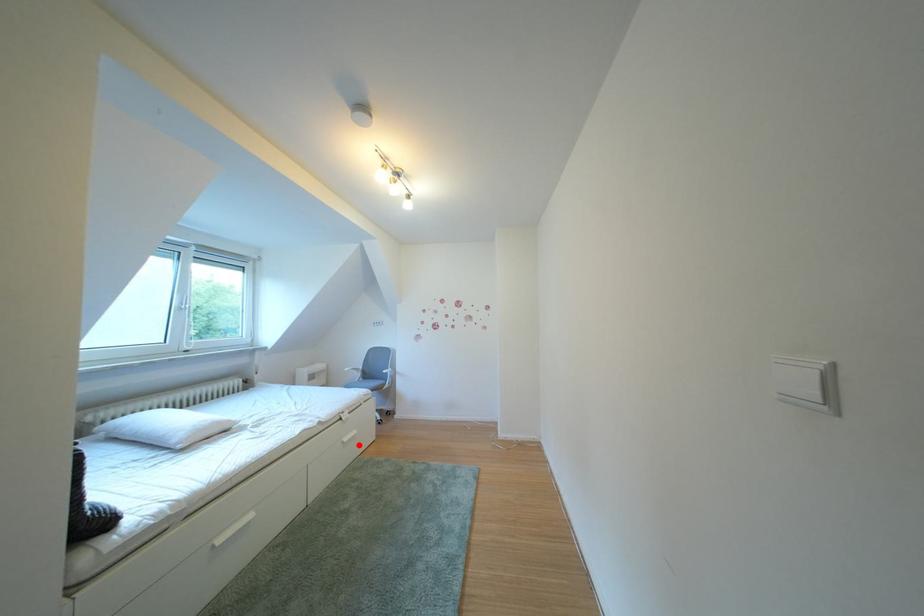
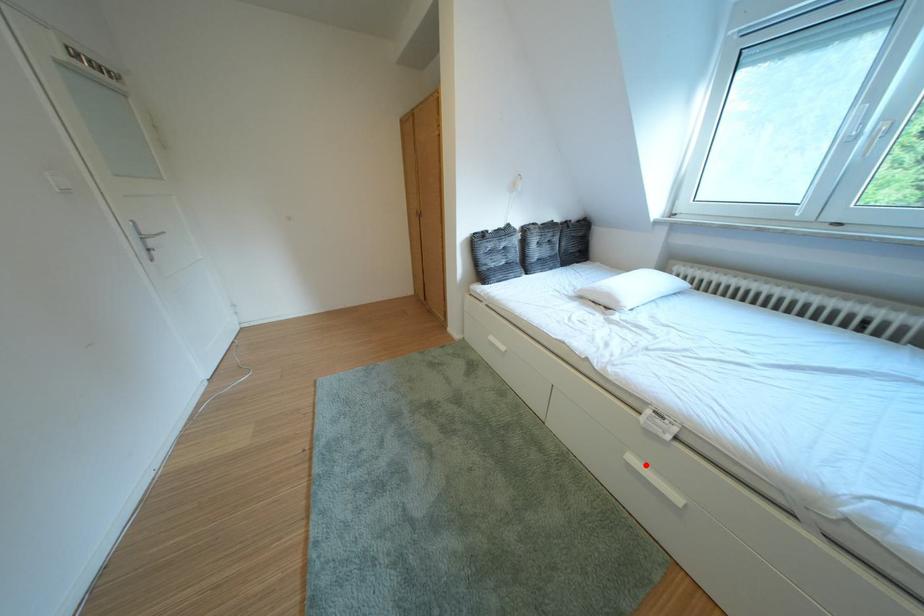
I am providing you with two images of the same scene from different viewpoints. A red point is marked on the first image and another point is marked on the second image. Does the point marked in image1 correspond to the same location as the one in image2?

Yes